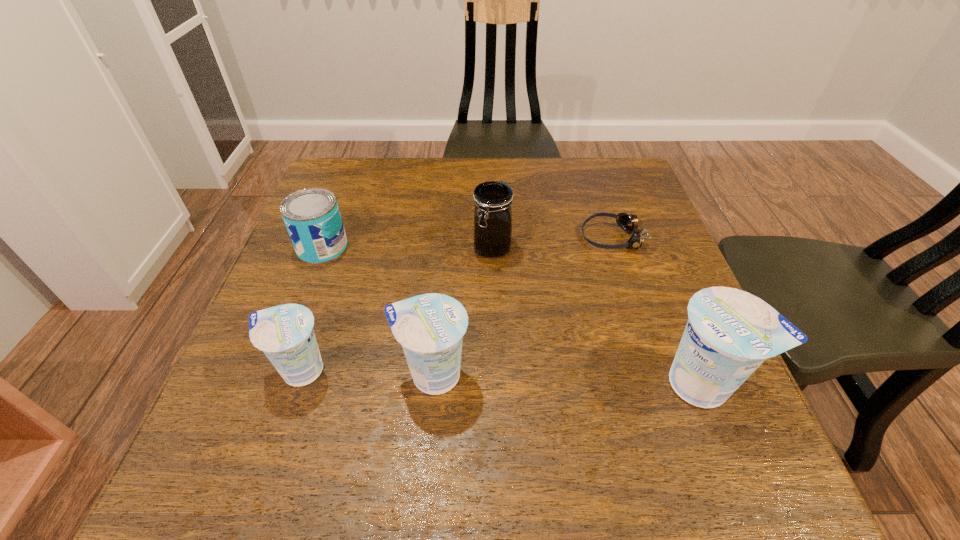
This screenshot has height=540, width=960. What are the coordinates of `vacant region between the shortest object and the rightmost yogurt` in the screenshot? It's located at [657, 310].

You are a GUI agent. You are given a task and a screenshot of the screen. Output one action in this format:
    pyautogui.click(x=<x>, y=<y>)
    Task: Click on the free point between the rightmost yogurt and the can
    
    Given the screenshot: What is the action you would take?
    pyautogui.click(x=513, y=315)

Locate an element on the screen. free space between the goggles and the can is located at coordinates (467, 242).

The width and height of the screenshot is (960, 540). I want to click on unoccupied area between the third object from right to left and the can, so click(407, 247).

Where is `free space between the second tallest yogurt and the goggles`? Image resolution: width=960 pixels, height=540 pixels. free space between the second tallest yogurt and the goggles is located at coordinates (521, 306).

At what (x,y) coordinates should I click in order to perform the action: click on object that is the closest to the shortest object. Please return your answer as a coordinate pair (x, y). Image resolution: width=960 pixels, height=540 pixels. Looking at the image, I should click on (492, 200).

Select which object appears as the second closest to the goggles. Please provide its 2D coordinates. Your answer should be formatted as a tuple, i.e. [(x, y)], where the tuple contains the x and y coordinates of a point satisfying the conditions above.

[(730, 333)]

Select which yogurt appears as the third closest to the goggles. Please provide its 2D coordinates. Your answer should be formatted as a tuple, i.e. [(x, y)], where the tuple contains the x and y coordinates of a point satisfying the conditions above.

[(285, 333)]

Choose which yogurt is the second nearest neighbor to the shortest object. Please provide its 2D coordinates. Your answer should be formatted as a tuple, i.e. [(x, y)], where the tuple contains the x and y coordinates of a point satisfying the conditions above.

[(430, 327)]

Identify the location of vacant area that satisfies the following two spatial constraints: 1. on the lid of the rightmost yogurt; 2. on the left side of the jar. Image resolution: width=960 pixels, height=540 pixels. (496, 384).